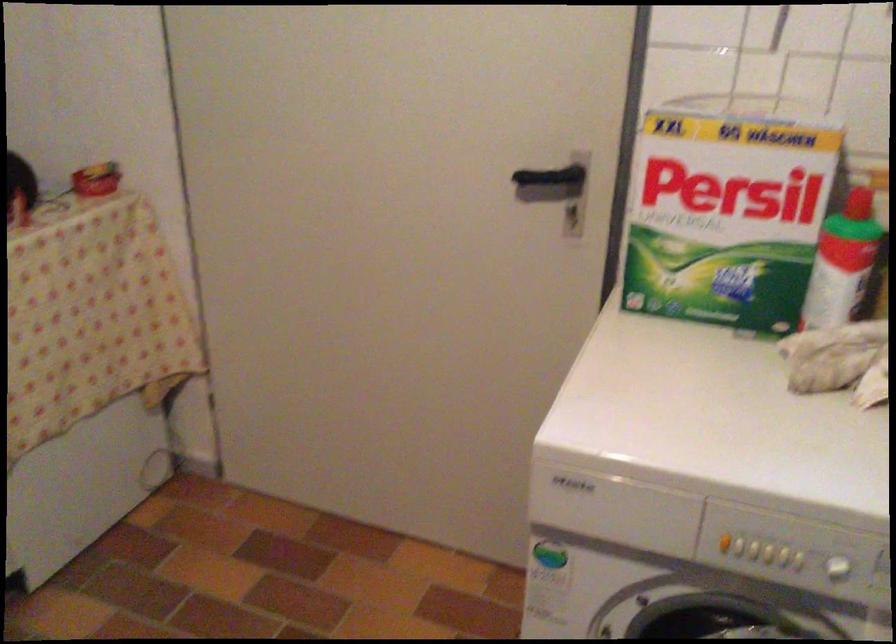
The height and width of the screenshot is (644, 896). Describe the element at coordinates (615, 509) in the screenshot. I see `a detergent drawer handle` at that location.